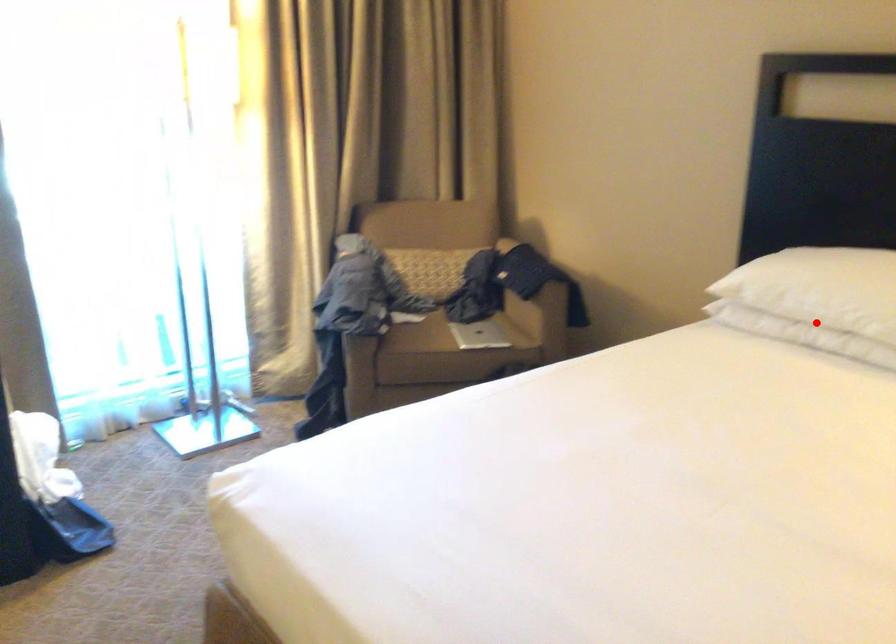
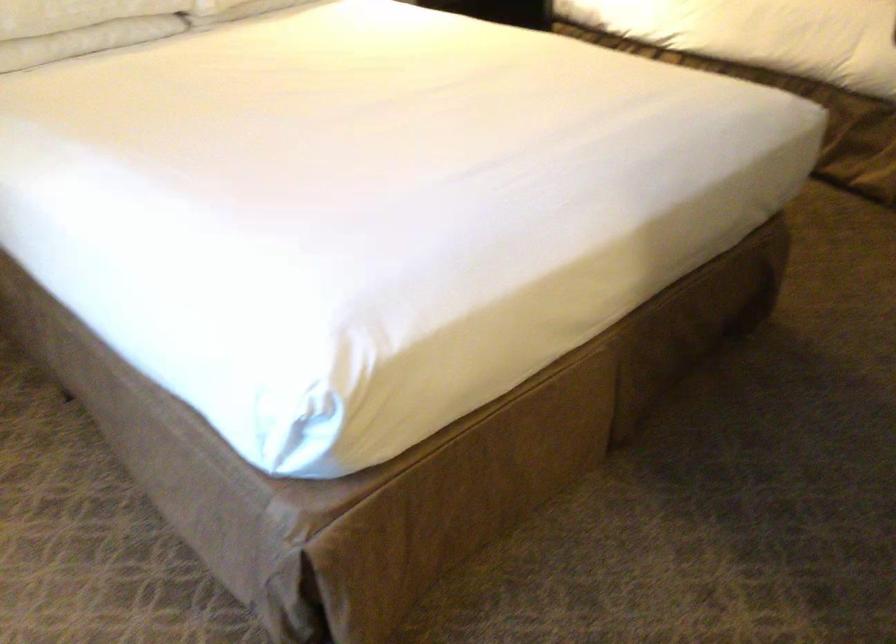
Locate, in the second image, the point that corresponds to the highlighted location in the first image.

(81, 26)